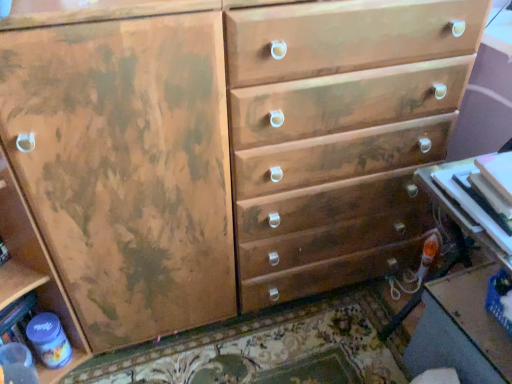
Question: Is matte plastic bottle at lower left taller or shorter than white glossy table at lower right, the 2th table positioned from the bottom?

Choices:
 (A) tall
 (B) short

Answer: (A)

Question: From a real-world perspective, relative to white glossy table at lower right, the first table in the top-to-bottom sequence, is matte plastic bottle at lower left vertically above or below?

Choices:
 (A) below
 (B) above

Answer: (A)

Question: Which object is the farthest from the white glossy table at lower right, the first table in the top-to-bottom sequence?

Choices:
 (A) matte plastic table at lower right, which is counted as the second table, starting from the front
 (B) matte plastic bottle at lower left

Answer: (B)

Question: Considering the real-world distances, which object is farthest from the matte plastic bottle at lower left?

Choices:
 (A) matte plastic table at lower right, which is counted as the second table, starting from the front
 (B) white glossy table at lower right, which ranks as the 1th table in front-to-back order

Answer: (B)